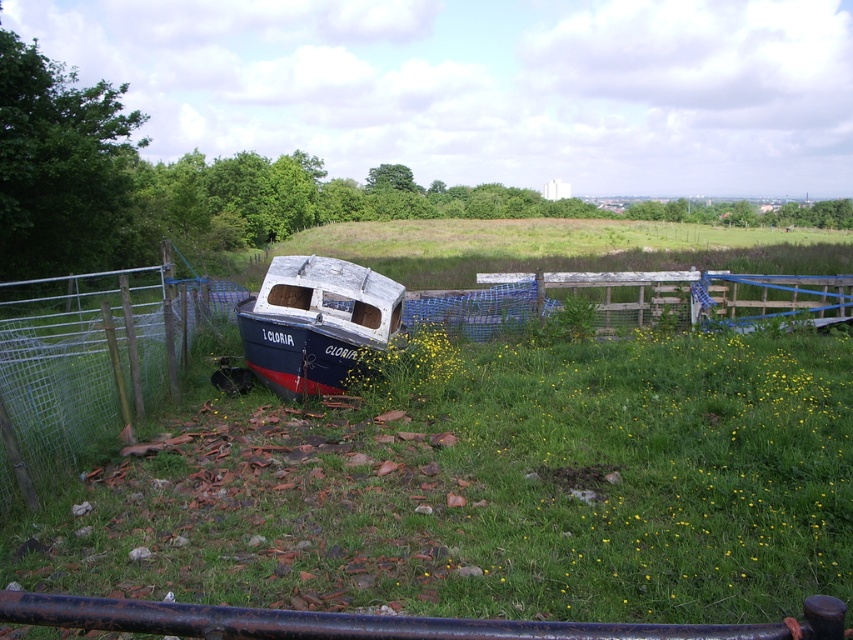
Question: Which object is the closest to the blue painted wooden boat at center?

Choices:
 (A) rusty metal rail at lower center
 (B) wire mesh fence at lower left
 (C) green grassy at center

Answer: (B)

Question: Does green grassy at center lie in front of wire mesh fence at lower left?

Choices:
 (A) yes
 (B) no

Answer: (A)

Question: Is green grassy at center wider than blue painted wooden boat at center?

Choices:
 (A) yes
 (B) no

Answer: (B)

Question: Among these points, which one is farthest from the camera?

Choices:
 (A) (686, 627)
 (B) (387, 308)
 (C) (10, 436)

Answer: (B)

Question: Observing the image, what is the correct spatial positioning of green grassy at center in reference to blue painted wooden boat at center?

Choices:
 (A) right
 (B) left

Answer: (A)

Question: Which point is farther from the camera taking this photo?

Choices:
 (A) (419, 620)
 (B) (183, 337)

Answer: (B)